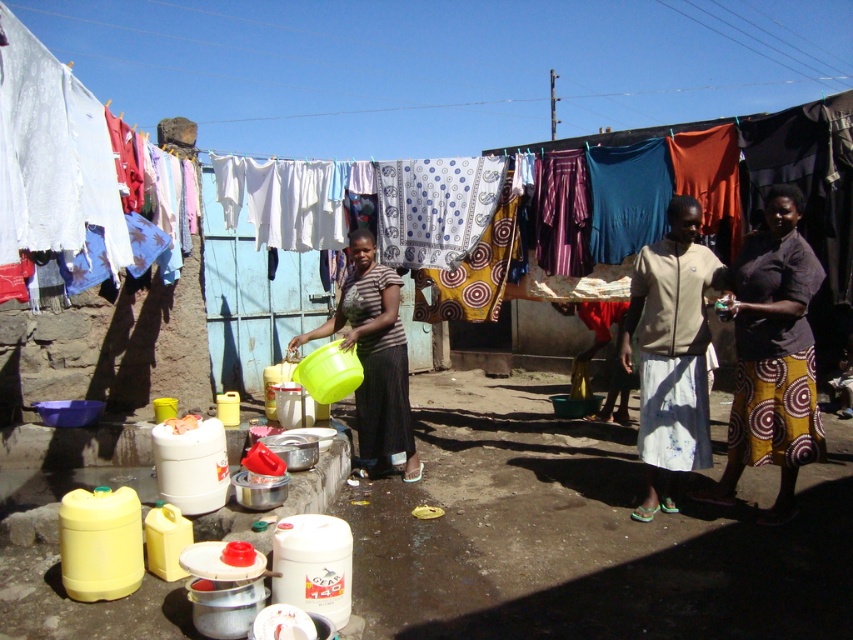
Who is positioned more to the left, beige fabric skirt at center or matte green plastic bucket at center?

matte green plastic bucket at center is more to the left.

Does beige fabric skirt at center appear over matte green plastic bucket at center?

Correct, beige fabric skirt at center is located above matte green plastic bucket at center.

Who is more distant from viewer, (647, 404) or (381, 460)?

The point (381, 460) is behind.

The image size is (853, 640). I want to click on beige fabric skirt at center, so click(x=671, y=353).

Which is in front, point (776, 198) or point (663, 291)?

Point (776, 198) is in front.

Can you confirm if yellow printed skirt at right is positioned above beige fabric skirt at center?

No, yellow printed skirt at right is not above beige fabric skirt at center.

Does point (791, 214) come behind point (672, 378)?

No, (791, 214) is in front of (672, 378).

At what (x,y) coordinates should I click in order to perform the action: click on yellow printed skirt at right. Please return your answer as a coordinate pair (x, y). Looking at the image, I should click on (772, 355).

Is yellow printed skirt at right positioned behind matte green plastic bucket at center?

No.

Who is higher up, yellow printed skirt at right or matte green plastic bucket at center?

yellow printed skirt at right is higher up.

Describe the element at coordinates (772, 355) in the screenshot. This screenshot has width=853, height=640. I see `yellow printed skirt at right` at that location.

You are a GUI agent. You are given a task and a screenshot of the screen. Output one action in this format:
    pyautogui.click(x=<x>, y=<y>)
    Task: Click on the yellow printed skirt at right
    
    Given the screenshot: What is the action you would take?
    pyautogui.click(x=772, y=355)